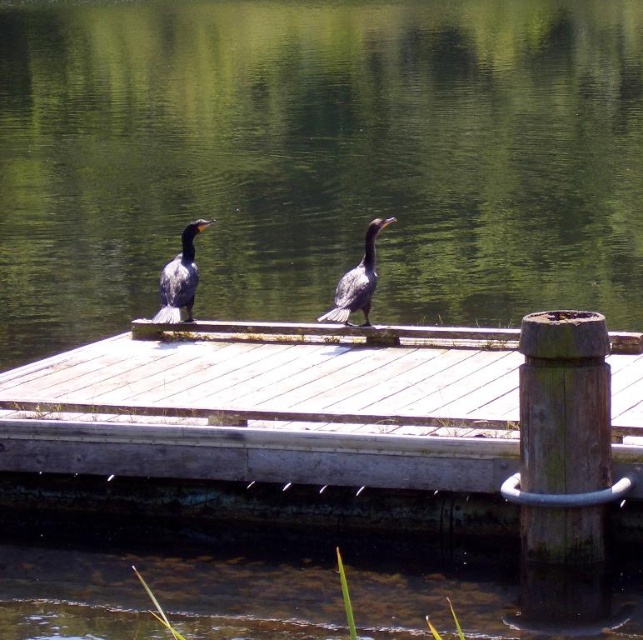
You are a birdwatcher standing on the dock and want to observe the green water at center. Which direction should you look to see it?

The green water at center is located at point coordinates (318, 160), so you should look towards the center of the image to see it.

You are a birdwatcher observing the scene from the shore. You notice the white wood dock at center and the gray matte bird at center. Which object is wider?

The white wood dock at center is wider than the gray matte bird at center because its width surpasses the bird.

You are standing on the lakeshore and looking at the white wood dock at center and the gray matte bird at center. Which object is closer to you?

The white wood dock at center is closer to you because it is positioned in front of the gray matte bird at center.